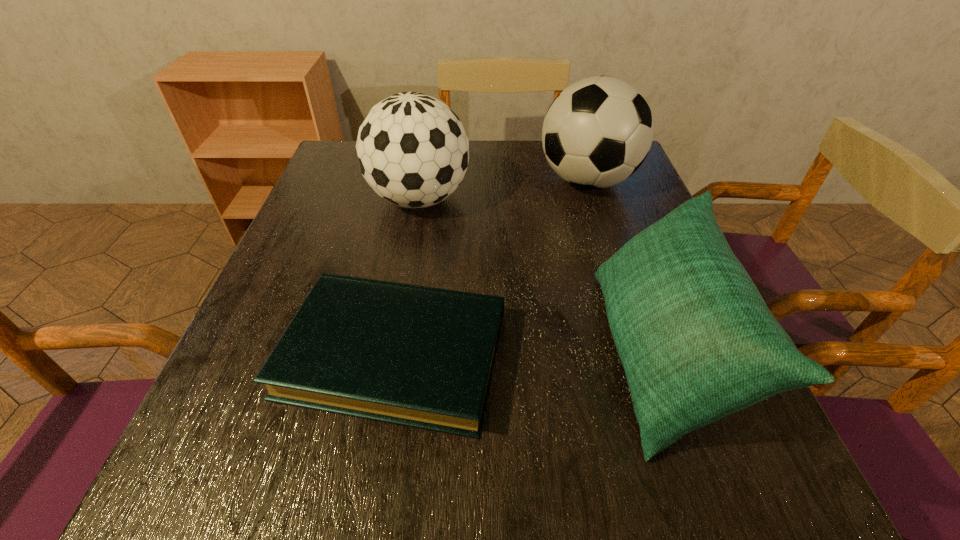
Locate an element on the screen. This screenshot has height=540, width=960. vacant space that's between the right soccer ball and the book is located at coordinates (491, 268).

You are a GUI agent. You are given a task and a screenshot of the screen. Output one action in this format:
    pyautogui.click(x=<x>, y=<y>)
    Task: Click on the unoccupied position between the left soccer ball and the cushion
    Image resolution: width=960 pixels, height=540 pixels.
    Given the screenshot: What is the action you would take?
    pyautogui.click(x=540, y=276)

Locate an element on the screen. The width and height of the screenshot is (960, 540). the second closest object to the second shortest object is located at coordinates (597, 132).

Choose which object is the nearest neighbor to the third tallest object. Please provide its 2D coordinates. Your answer should be formatted as a tuple, i.e. [(x, y)], where the tuple contains the x and y coordinates of a point satisfying the conditions above.

[(418, 356)]

Find the location of `free space that satisfies the following two spatial constraints: 1. on the front side of the shortest object; 2. on the right side of the left soccer ball`. free space that satisfies the following two spatial constraints: 1. on the front side of the shortest object; 2. on the right side of the left soccer ball is located at coordinates (392, 355).

Where is `free space that satisfies the following two spatial constraints: 1. on the front side of the left soccer ball; 2. on the right side of the shortest object`? free space that satisfies the following two spatial constraints: 1. on the front side of the left soccer ball; 2. on the right side of the shortest object is located at coordinates (392, 355).